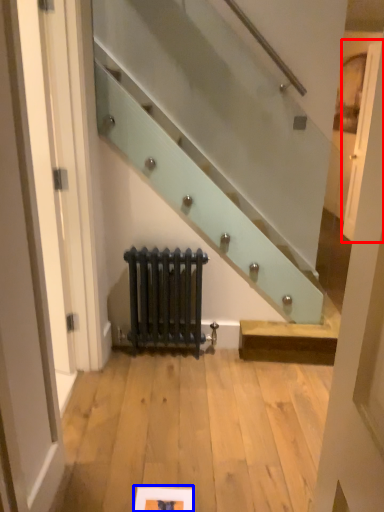
Question: Which object is further to the camera taking this photo, door (highlighted by a red box) or picture frame (highlighted by a blue box)?

Choices:
 (A) door
 (B) picture frame

Answer: (A)